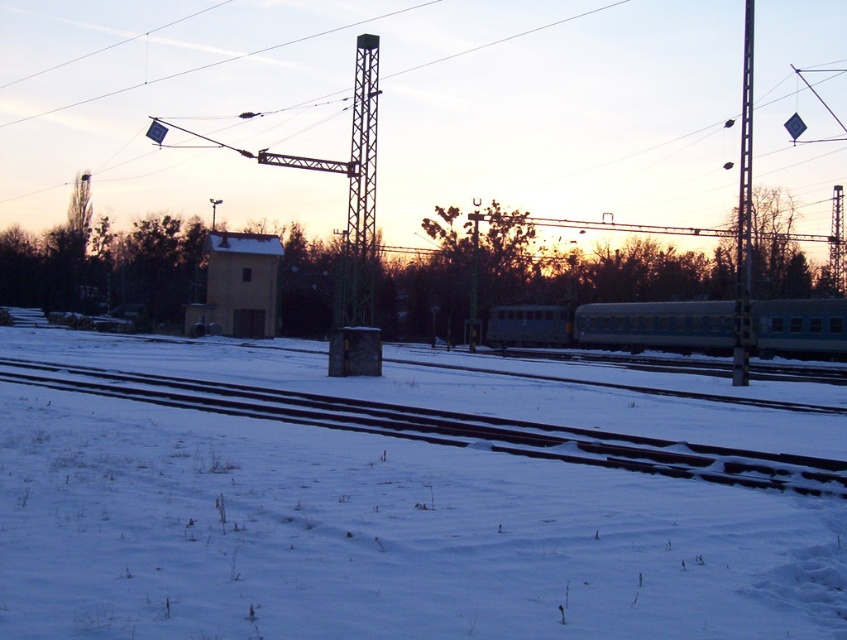
I want to click on smooth steel tracks at lower center, so click(447, 428).

Between smooth steel tracks at lower center and gray metallic train at center, which one has more height?

gray metallic train at center

Describe the element at coordinates (447, 428) in the screenshot. I see `smooth steel tracks at lower center` at that location.

At what (x,y) coordinates should I click in order to perform the action: click on smooth steel tracks at lower center. Please return your answer as a coordinate pair (x, y). Image resolution: width=847 pixels, height=640 pixels. Looking at the image, I should click on (447, 428).

Based on the photo, who is taller, smooth steel tracks at lower center or metallic pole at right?

Standing taller between the two is metallic pole at right.

Is point (314, 397) positioned in front of point (745, 236)?

Yes, it is in front of point (745, 236).

Which is behind, point (192, 390) or point (750, 260)?

The point (750, 260) is more distant.

The height and width of the screenshot is (640, 847). What are the coordinates of `smooth steel tracks at lower center` in the screenshot? It's located at (447, 428).

Which is more to the left, smooth steel tracks at lower center or metallic tower at center?

metallic tower at center

Between smooth steel tracks at lower center and metallic tower at center, which one appears on the right side from the viewer's perspective?

From the viewer's perspective, smooth steel tracks at lower center appears more on the right side.

Describe the element at coordinates (447, 428) in the screenshot. The image size is (847, 640). I see `smooth steel tracks at lower center` at that location.

Locate an element on the screen. smooth steel tracks at lower center is located at coordinates (447, 428).